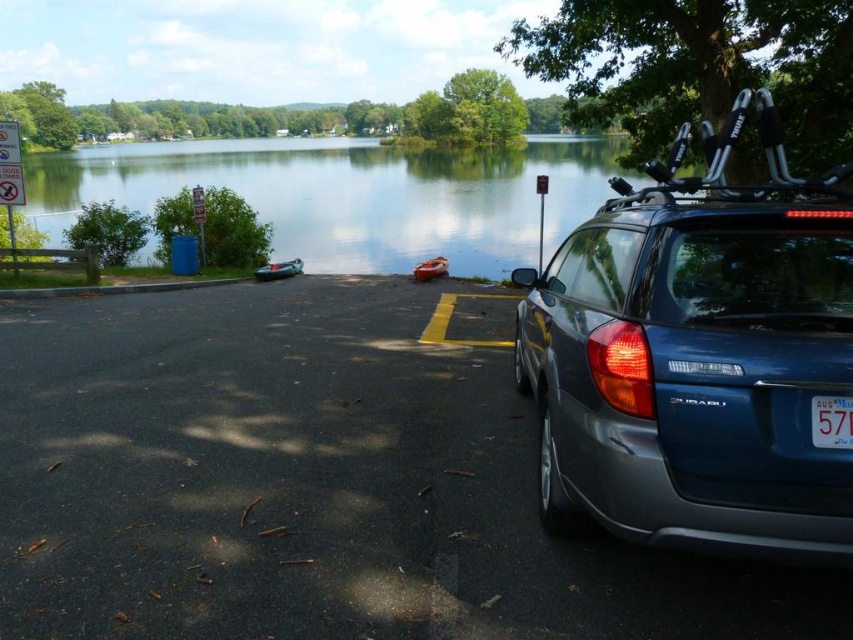
Question: Where is metallic blue car at right located in relation to clear water at lake center in the image?

Choices:
 (A) left
 (B) right

Answer: (B)

Question: Can you confirm if metallic blue car at right is positioned to the left of clear water at lake center?

Choices:
 (A) yes
 (B) no

Answer: (B)

Question: Which point appears closest to the camera in this image?

Choices:
 (A) (518, 156)
 (B) (608, 556)

Answer: (B)

Question: Among these points, which one is farthest from the camera?

Choices:
 (A) pos(817,410)
 (B) pos(582,390)
 (C) pos(498,260)

Answer: (C)

Question: Estimate the real-world distances between objects in this image. Which object is closer to the metallic blue car at right?

Choices:
 (A) clear water at lake center
 (B) dark gray asphalt at lower right
 (C) blue plastic license plate at lower right

Answer: (C)

Question: Is dark gray asphalt at lower right thinner than metallic blue car at right?

Choices:
 (A) no
 (B) yes

Answer: (A)